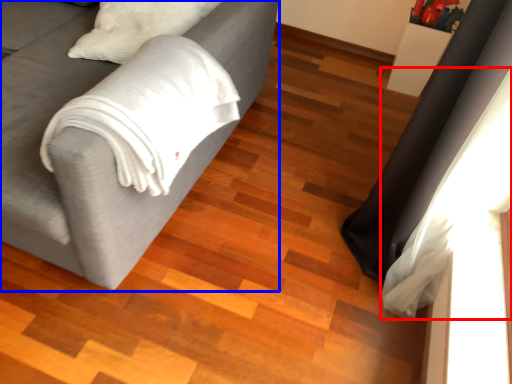
Question: Which object appears closest to the camera in this image, curtain (highlighted by a red box) or studio couch (highlighted by a blue box)?

Choices:
 (A) curtain
 (B) studio couch

Answer: (B)